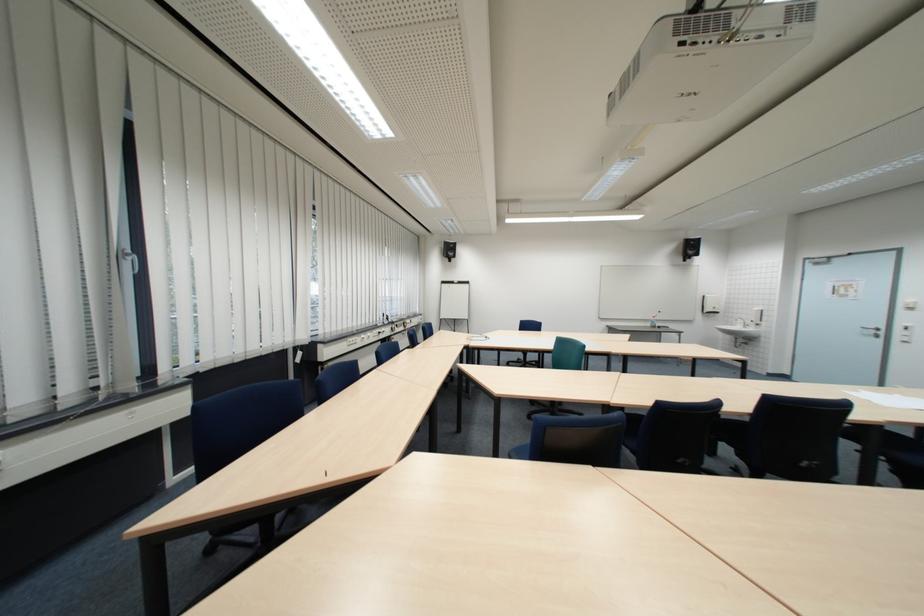
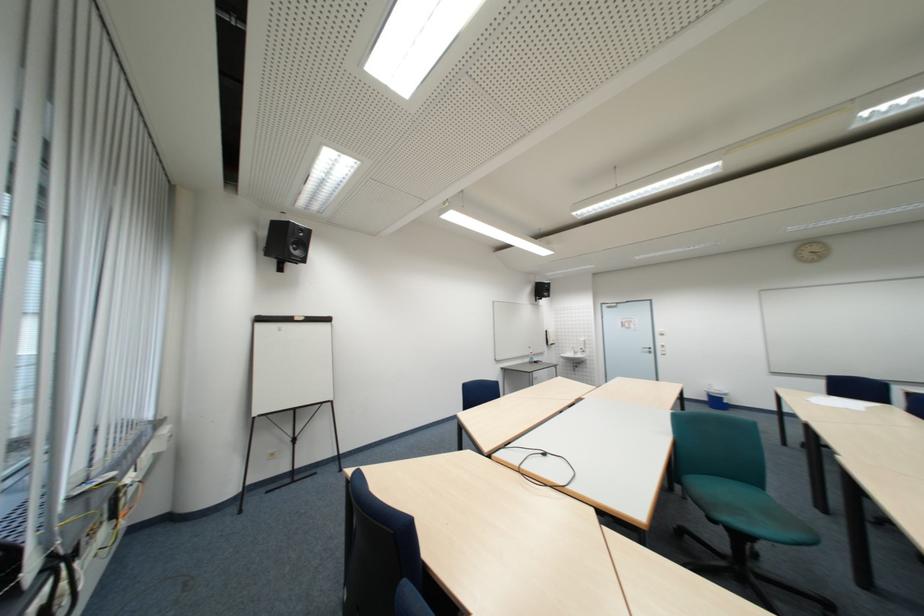
Find the pixel in the second image that matches [456,284] in the first image.

(273, 321)